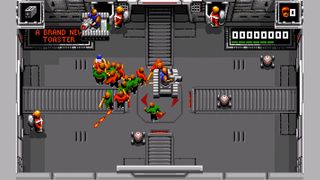
Where is `screen`? The height and width of the screenshot is (180, 320). screen is located at coordinates (56, 35).